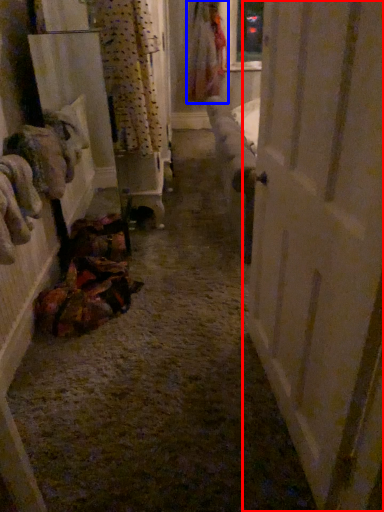
Question: Which object is further to the camera taking this photo, door (highlighted by a red box) or clothing (highlighted by a blue box)?

Choices:
 (A) door
 (B) clothing

Answer: (B)